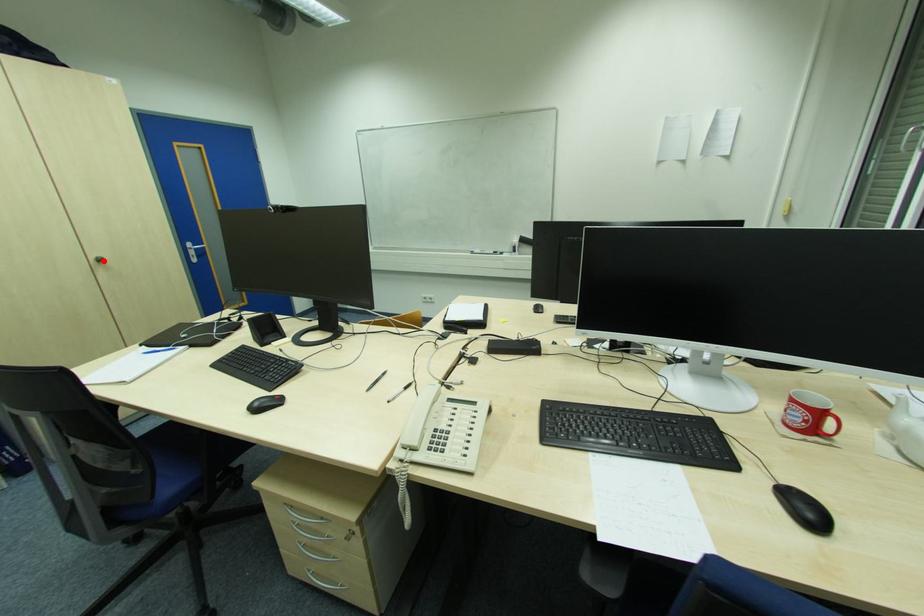
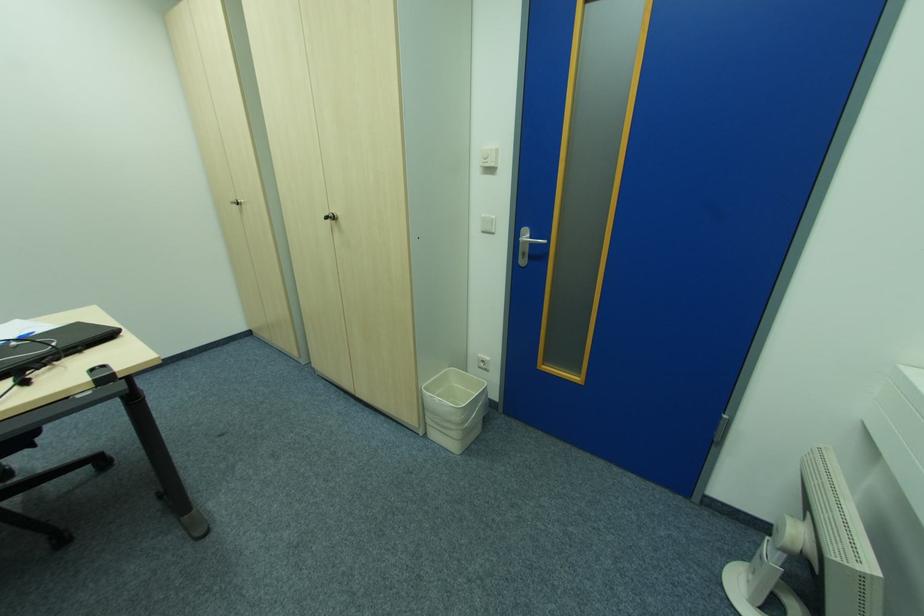
Where in the second image is the point corresponding to the highlighted location from the first image?

(334, 219)